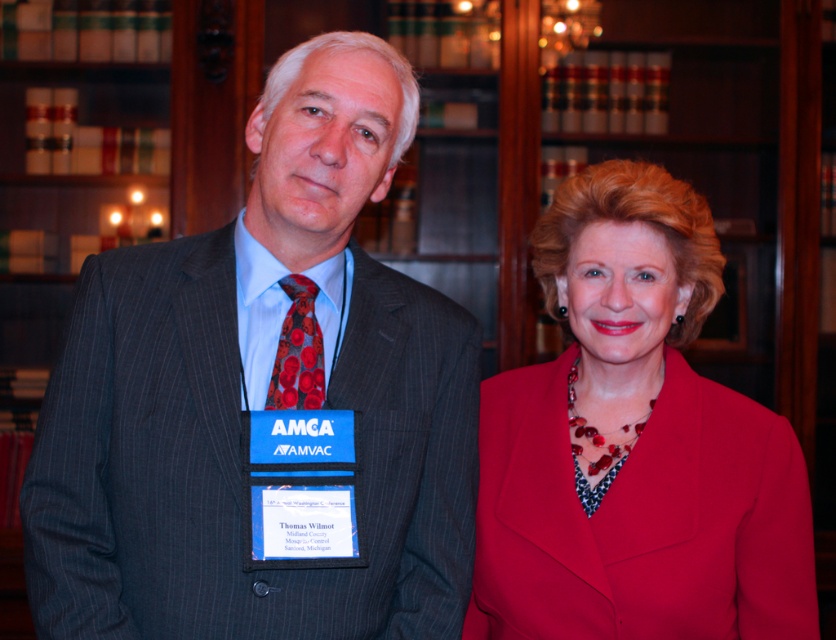
You are standing at the point closest to you in the image. There are two points marked in the scene, one at coordinates point [371,288] and another at point [320,372]. Which point is farther away from your current position?

Point [371,288] is behind point [320,372], so the point farther away from your current position is point [371,288].

You are a photographer positioned in front of the two people. You want to take a photo focusing on the gray pinstripe suit at center and the red satin tie at center. Which object will appear larger in the photo?

The gray pinstripe suit at center will appear larger in the photo because it is closer to the viewer than the red satin tie at center.